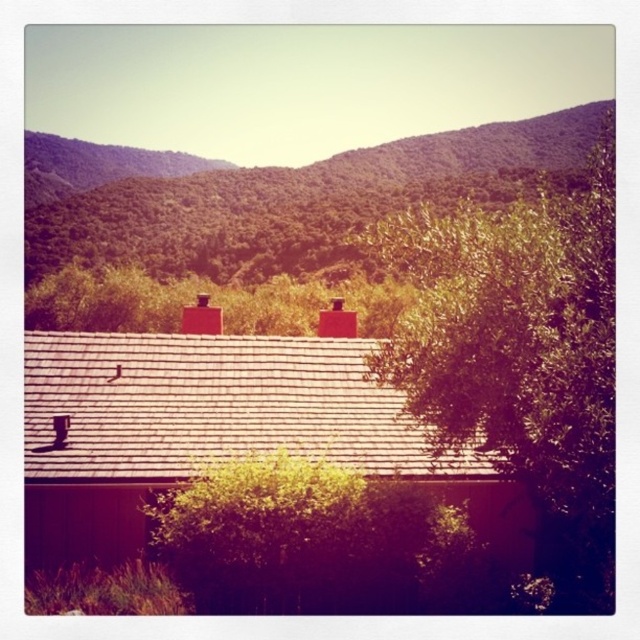
You are standing in front of the house and notice two points marked in the image. The first point is at coordinates point (426, 227) and the second is at point (132, 218). Which point is closer to you?

Point (426, 227) is closer to the camera than point (132, 218).

You are a landscape architect designing a garden path that needs to pass between the green leafy tree at right and the green leafy tree at center. Considering their sizes, which tree might require more space to accommodate its canopy?

The green leafy tree at right is larger in size than the green leafy tree at center, so it would require more space to accommodate its canopy.